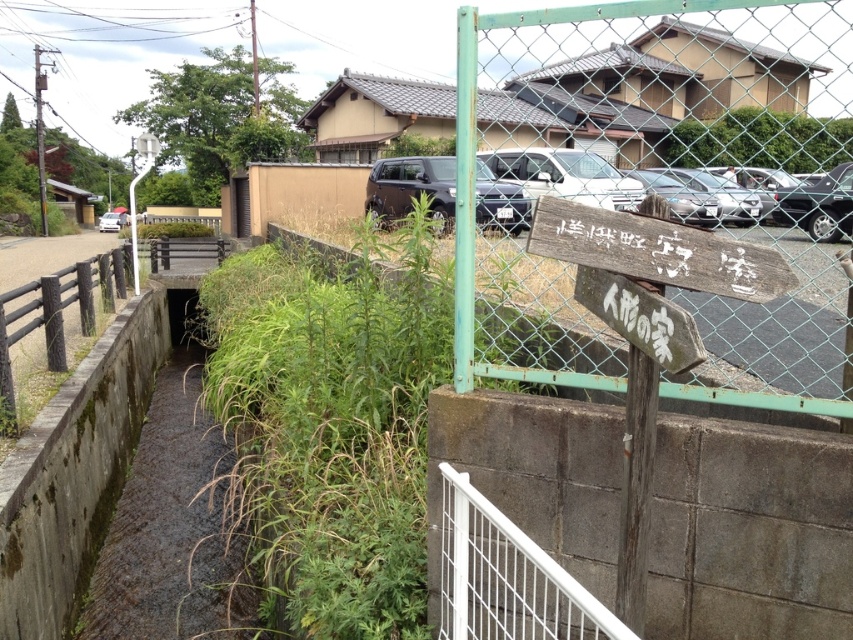
Question: Among these points, which one is farthest from the camera?

Choices:
 (A) (399, 172)
 (B) (434, 168)
 (C) (654, 272)
 (D) (49, 355)

Answer: (A)

Question: Estimate the real-world distances between objects in this image. Which object is closer to the wooden signpost at center-right?

Choices:
 (A) matte black suv at center
 (B) wooden sign at center
 (C) dark gray metallic suv at center
 (D) brown wooden rail at left

Answer: (B)

Question: Which point is farther to the camera?

Choices:
 (A) wooden sign at center
 (B) white metal rail at lower center
 (C) wooden signpost at center-right
 (D) matte black suv at center

Answer: (D)

Question: Does satin black suv at center have a greater width compared to matte black suv at center?

Choices:
 (A) no
 (B) yes

Answer: (A)

Question: Can you confirm if satin black suv at center is positioned to the left of matte black suv at center?

Choices:
 (A) yes
 (B) no

Answer: (B)

Question: Is brown wooden rail at left smaller than matte black suv at center?

Choices:
 (A) yes
 (B) no

Answer: (B)